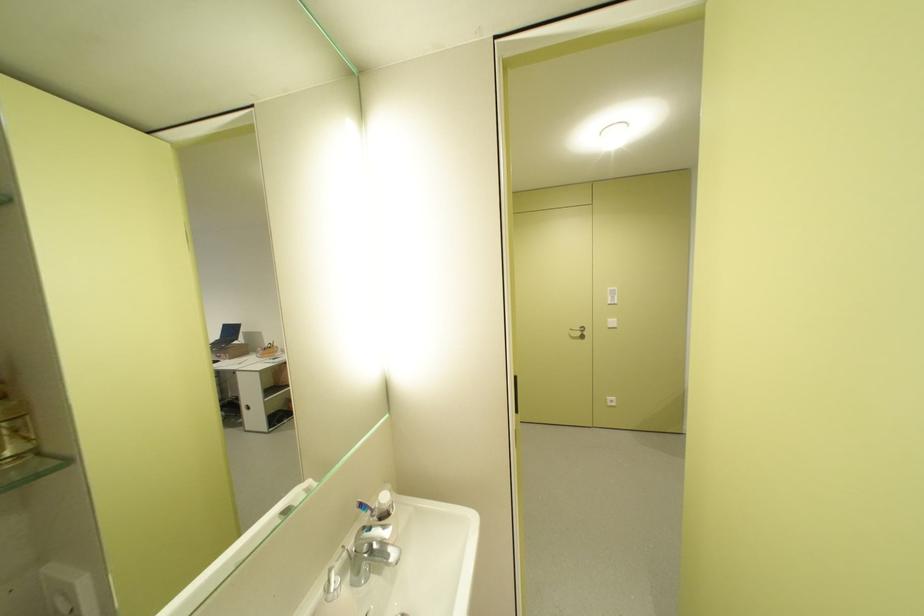
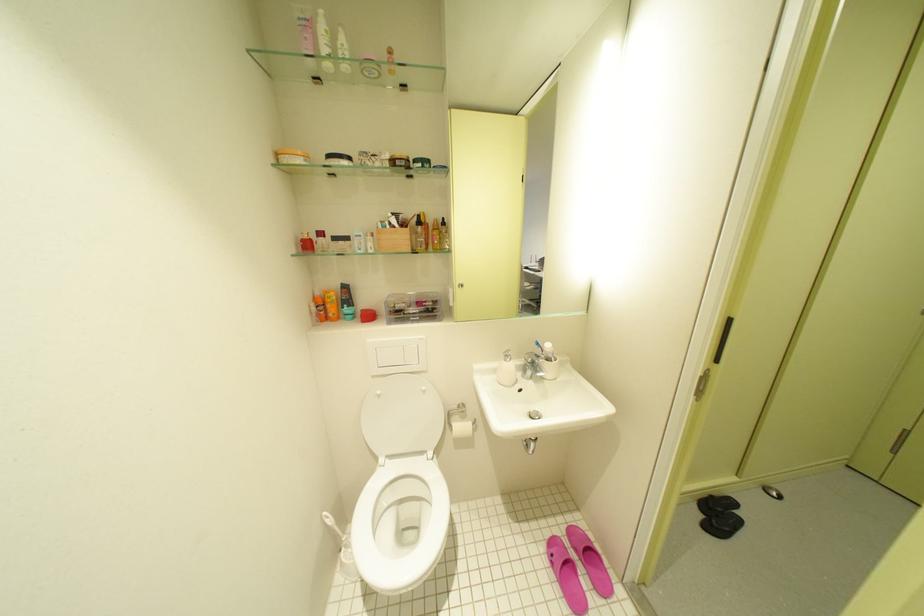
The point at (x=371, y=507) is marked in the first image. Where is the corresponding point in the second image?

(546, 345)